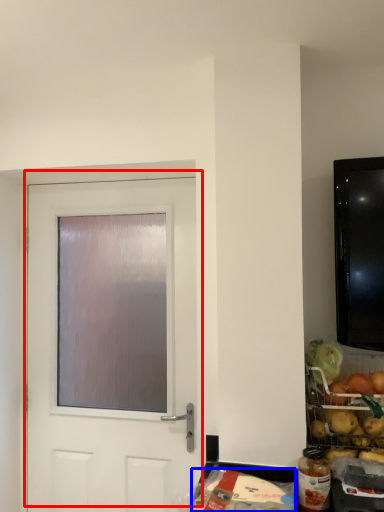
Question: Among these objects, which one is farthest to the camera, door (highlighted by a red box) or food (highlighted by a blue box)?

Choices:
 (A) door
 (B) food

Answer: (A)